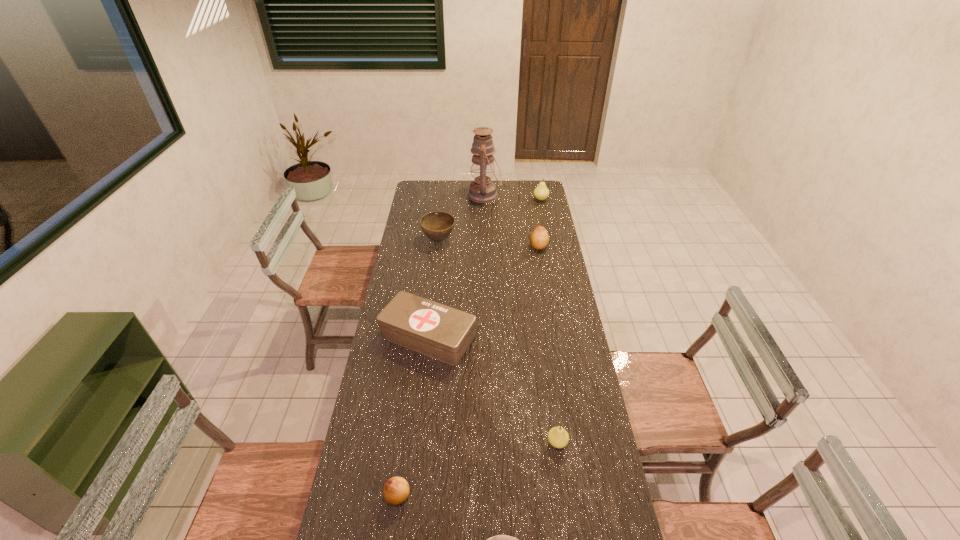
The height and width of the screenshot is (540, 960). In order to click on blue oil lamp in this screenshot , I will do `click(482, 190)`.

This screenshot has width=960, height=540. What are the coordinates of `the tallest object` in the screenshot? It's located at (482, 190).

The width and height of the screenshot is (960, 540). In order to click on the right green pear in this screenshot , I will do `click(541, 192)`.

Where is `the farthest pear`? the farthest pear is located at coordinates (541, 192).

Where is `the right brown pear`? The height and width of the screenshot is (540, 960). the right brown pear is located at coordinates (539, 238).

Identify the location of the third nearest pear. (539, 238).

Identify the location of the left bowl. This screenshot has height=540, width=960. (437, 226).

Find the location of a particular element. the taller bowl is located at coordinates (437, 226).

I want to click on the fifth farthest object, so click(x=436, y=330).

Locate an element on the screen. This screenshot has width=960, height=540. the smaller green pear is located at coordinates pyautogui.click(x=558, y=437).